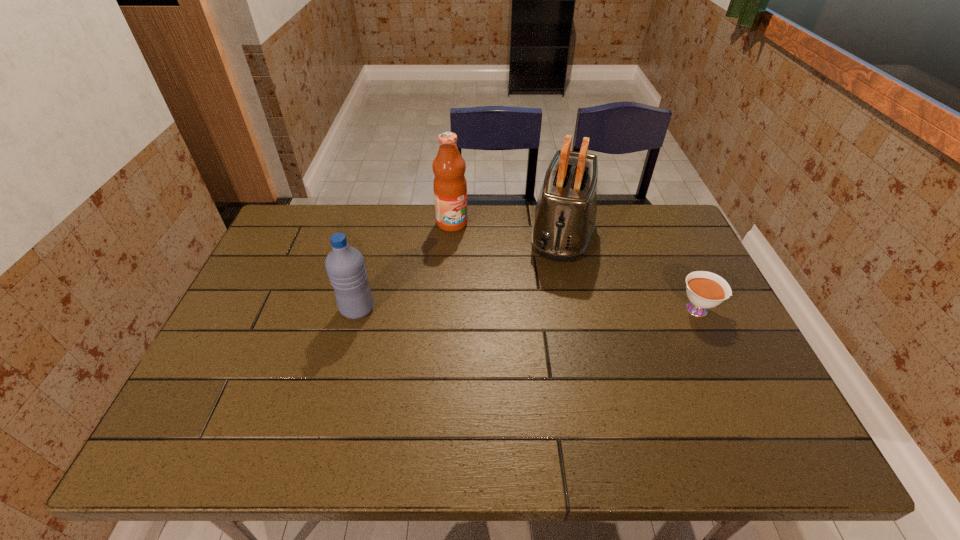
Identify the location of free space on the desktop that is between the water bottle and the rightmost object and is positioned on the front label of the third object from right to left. (548, 309).

Locate an element on the screen. This screenshot has height=540, width=960. free space on the desktop that is between the leftmost object and the rightmost object and is positioned on the side of the toaster with the control lever is located at coordinates (543, 309).